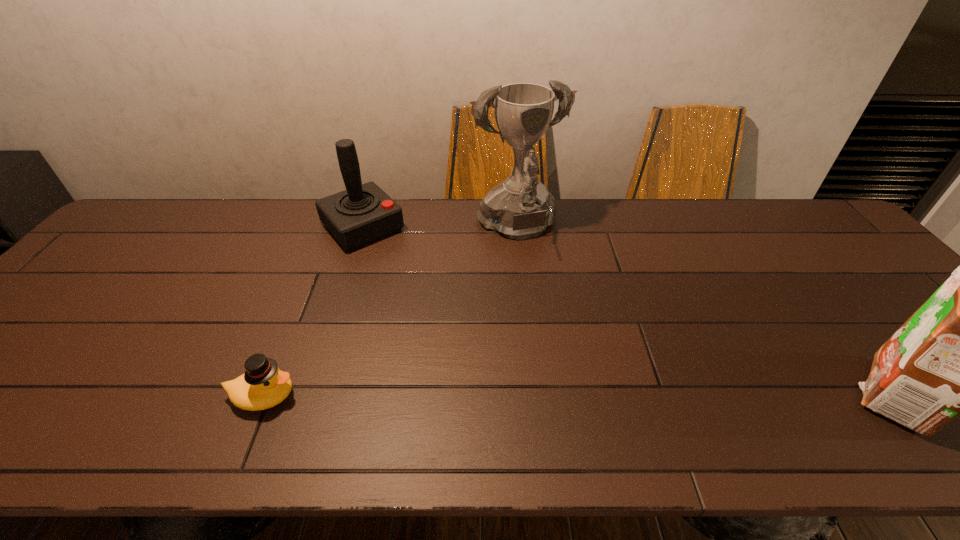
Where is `the shortest object`? the shortest object is located at coordinates (263, 385).

Image resolution: width=960 pixels, height=540 pixels. Identify the location of the tallest object. (521, 207).

Where is `the second object from right to left`? the second object from right to left is located at coordinates (521, 207).

Locate an element on the screen. This screenshot has width=960, height=540. joystick is located at coordinates (363, 213).

Identify the location of free space located 0.290m on the front-facing side of the shortest object. click(435, 396).

The image size is (960, 540). I want to click on vacant space located on the side with emblem of the award, so click(573, 331).

The width and height of the screenshot is (960, 540). I want to click on vacant space located 0.320m on the side with emblem of the award, so click(x=582, y=347).

The width and height of the screenshot is (960, 540). What are the coordinates of `vacant space located 0.160m on the side with emblem of the award` in the screenshot? It's located at (556, 300).

The width and height of the screenshot is (960, 540). Find the location of `vacant space located on the base of the joystick`. vacant space located on the base of the joystick is located at coordinates (461, 333).

Identify the location of blank space located on the base of the joystick. (409, 276).